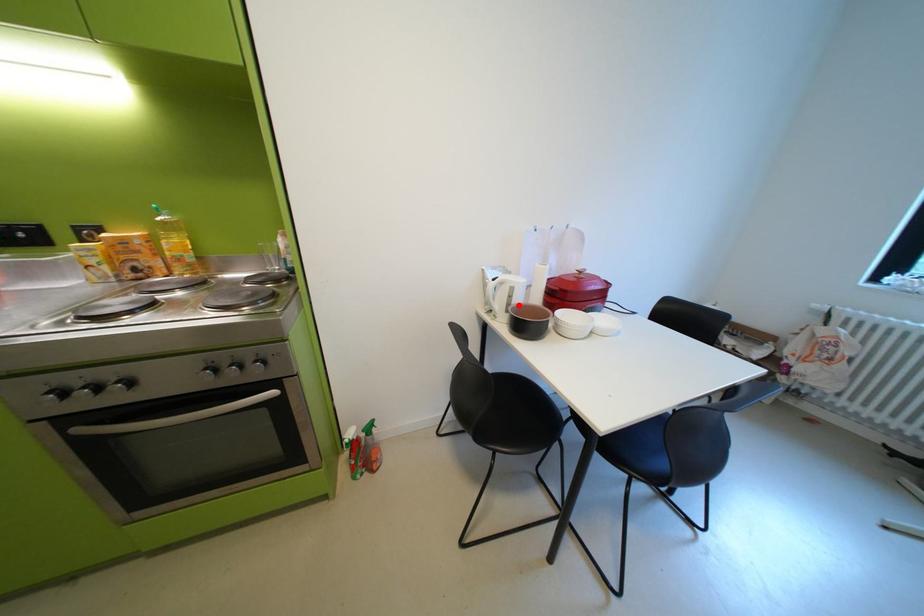
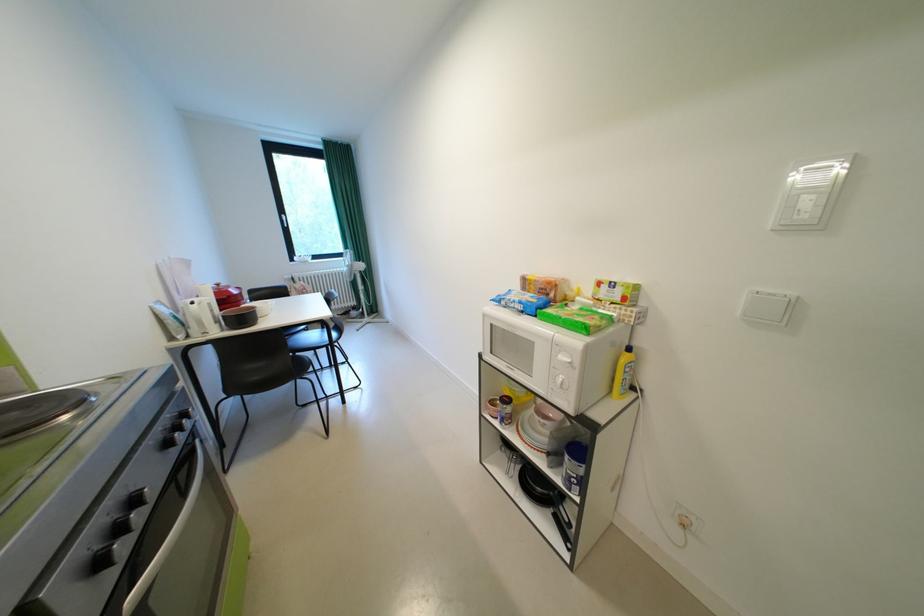
In the second image, find the point that corresponds to the highlighted location in the first image.

(225, 317)